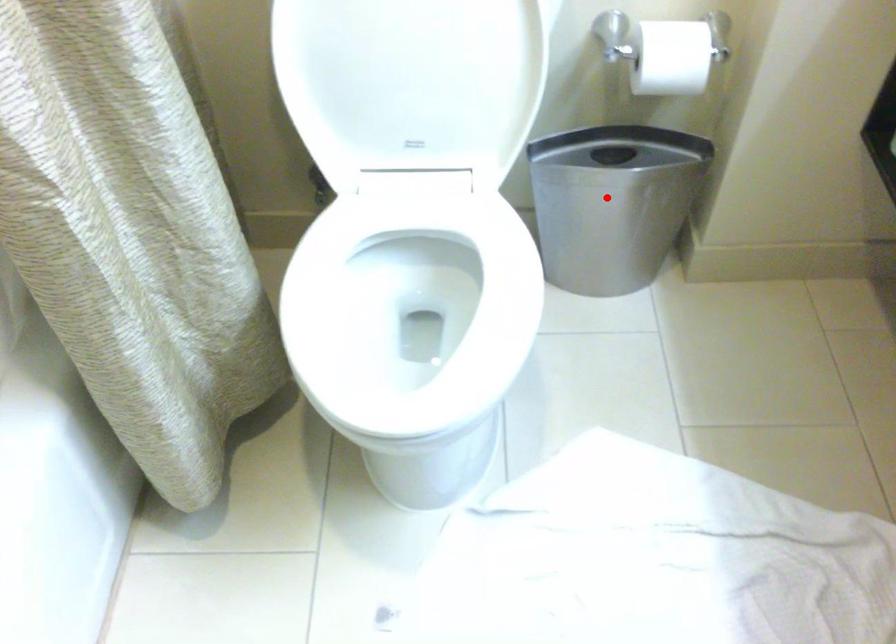
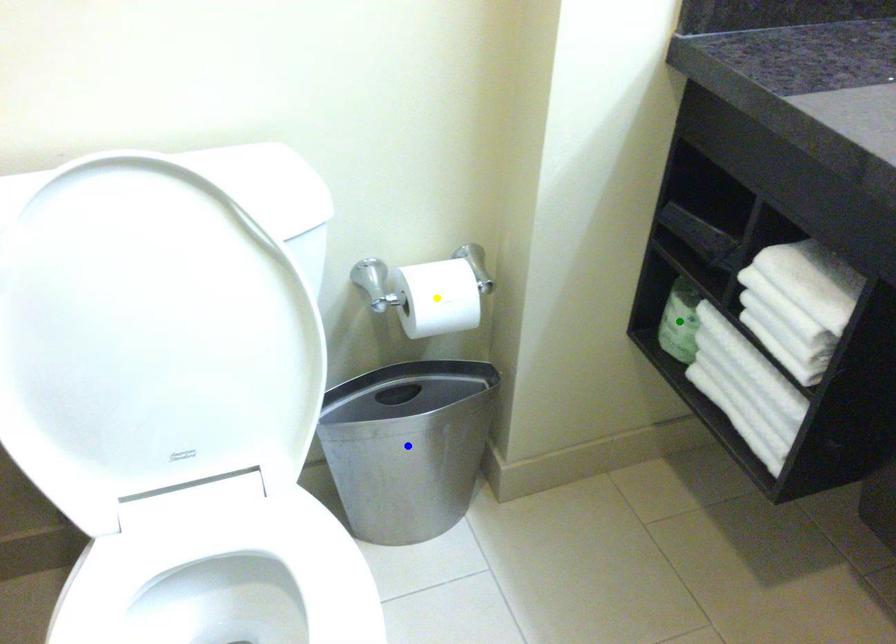
Question: I am providing you with two images of the same scene from different viewpoints. A red point is marked on the first image. You are given multiple points on the second image. Which point in image 2 represents the same 3d spot as the red point in image 1?

Choices:
 (A) green point
 (B) yellow point
 (C) blue point

Answer: (C)